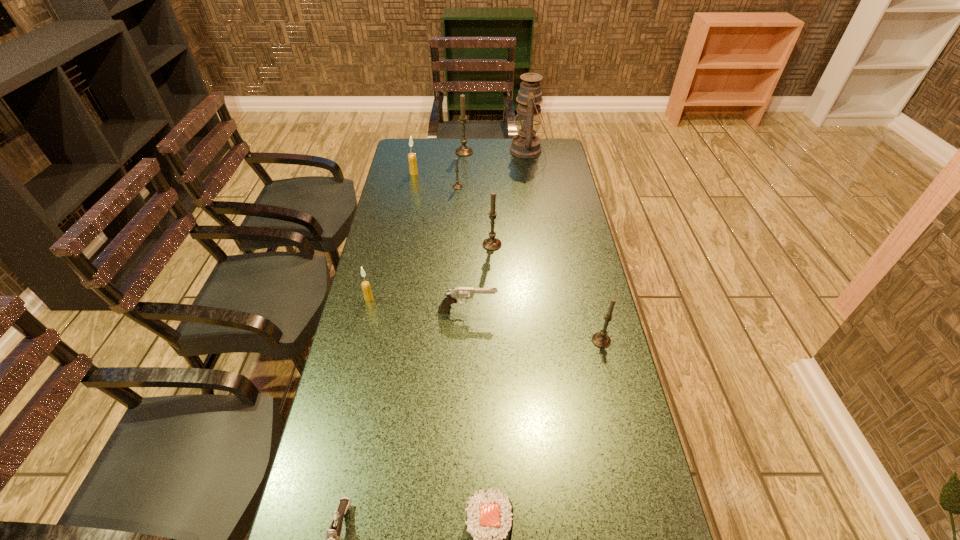
Where is `the second farthest gray candle`? the second farthest gray candle is located at coordinates (456, 186).

Find the location of a particular element. This screenshot has height=540, width=960. the smallest gray candle is located at coordinates (456, 186).

You are a GUI agent. You are given a task and a screenshot of the screen. Output one action in this format:
    pyautogui.click(x=<x>, y=<y>)
    Task: Click on the nearer cream candle
    The image size is (960, 540).
    Given the screenshot: What is the action you would take?
    pyautogui.click(x=365, y=285)

The image size is (960, 540). What are the coordinates of `the sixth farthest object` in the screenshot? It's located at (365, 285).

Identify the location of the seventh farthest object. The height and width of the screenshot is (540, 960). (452, 296).

You are a GUI agent. You are given a task and a screenshot of the screen. Output one action in this format:
    pyautogui.click(x=<x>, y=<y>)
    Task: Click on the taller gun
    Image resolution: width=960 pixels, height=540 pixels.
    Given the screenshot: What is the action you would take?
    pyautogui.click(x=452, y=296)

Locate an element on the screen. This screenshot has width=960, height=540. vacant region located on the left of the oil lamp is located at coordinates (482, 150).

The image size is (960, 540). What are the coordinates of `free space located on the front of the second tallest object` in the screenshot? It's located at [463, 182].

Find the location of a particular element. The image size is (960, 540). vacant space located on the left of the second tallest candle is located at coordinates (449, 245).

You are a GUI agent. You are given a task and a screenshot of the screen. Output one action in this format:
    pyautogui.click(x=<x>, y=<y>)
    Task: Click on the vacant region located 0.380m on the front of the right cream candle
    The width and height of the screenshot is (960, 540).
    Given the screenshot: What is the action you would take?
    pyautogui.click(x=402, y=232)